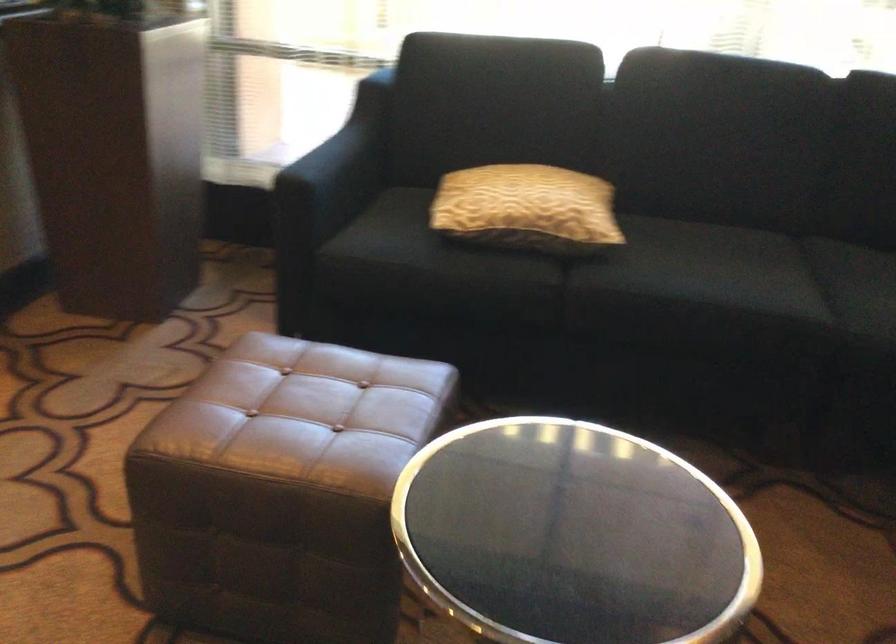
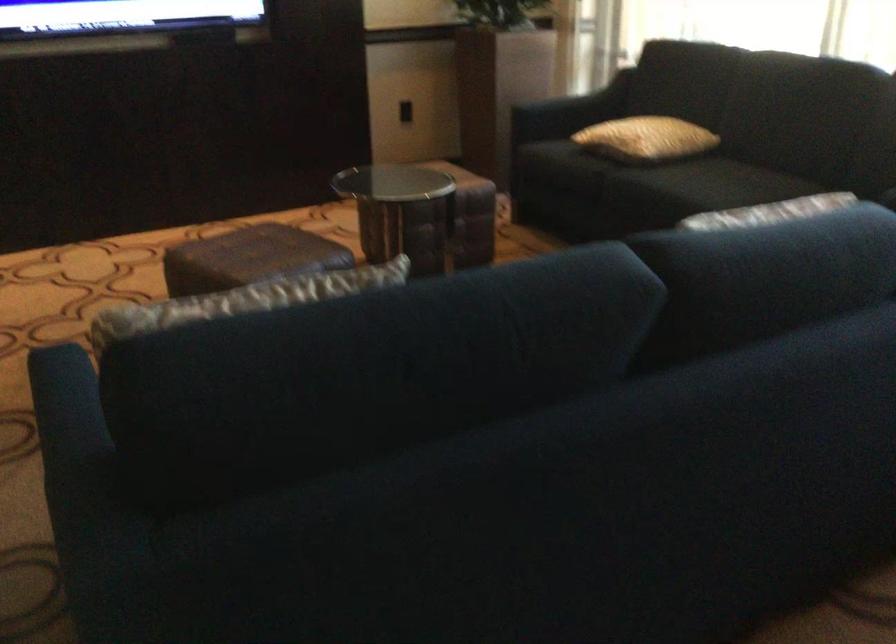
Where in the second image is the point corresponding to point 350,149 from the first image?

(586, 99)